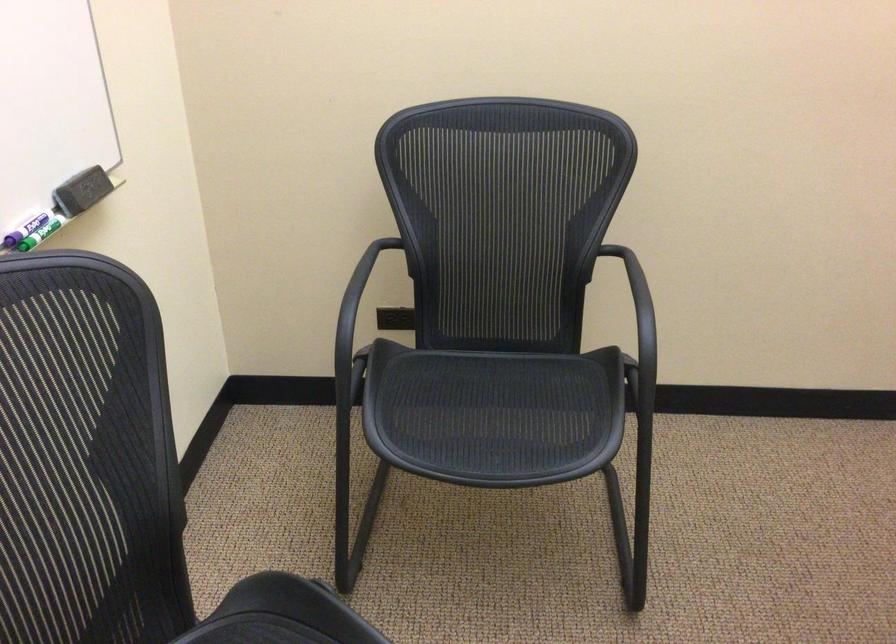
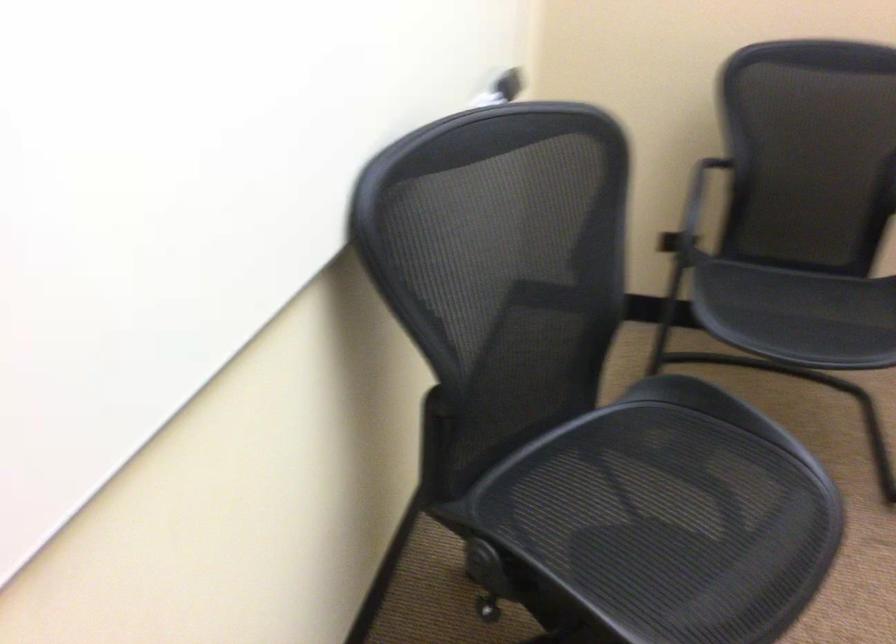
Based on the photo, in a continuous first-person perspective shot, in which direction is the camera moving?

The cameraman walked toward left, backward.